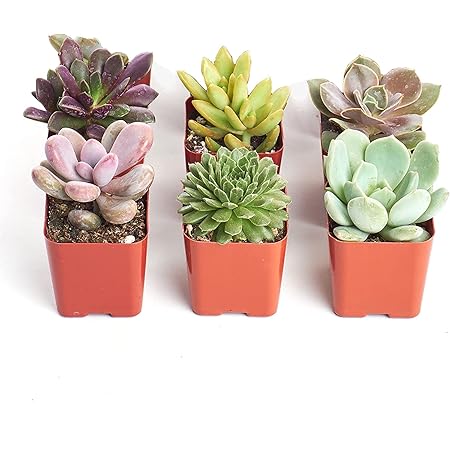
You are a GUI agent. You are given a task and a screenshot of the screen. Output one action in this format:
    pyautogui.click(x=<x>, y=<y>)
    Task: Click on the flower containers
    The height and width of the screenshot is (450, 450).
    Given the screenshot: What is the action you would take?
    click(x=381, y=264), click(x=236, y=272), click(x=113, y=287), click(x=189, y=156), click(x=325, y=157)